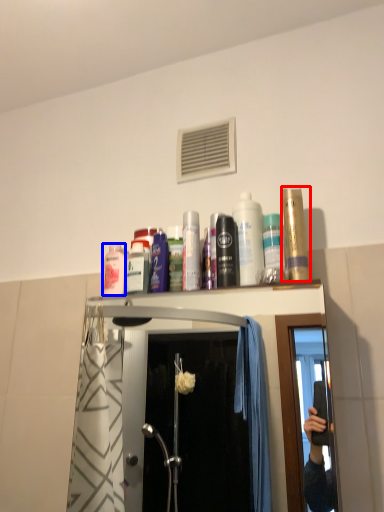
Question: Which object appears closest to the camera in this image, mouthwash (highlighted by a red box) or mouthwash (highlighted by a blue box)?

Choices:
 (A) mouthwash
 (B) mouthwash

Answer: (A)